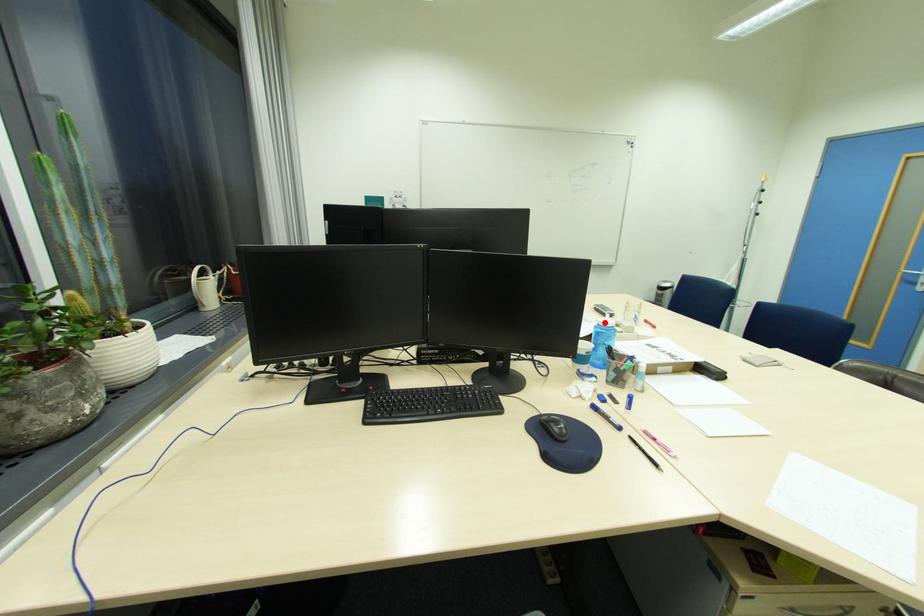
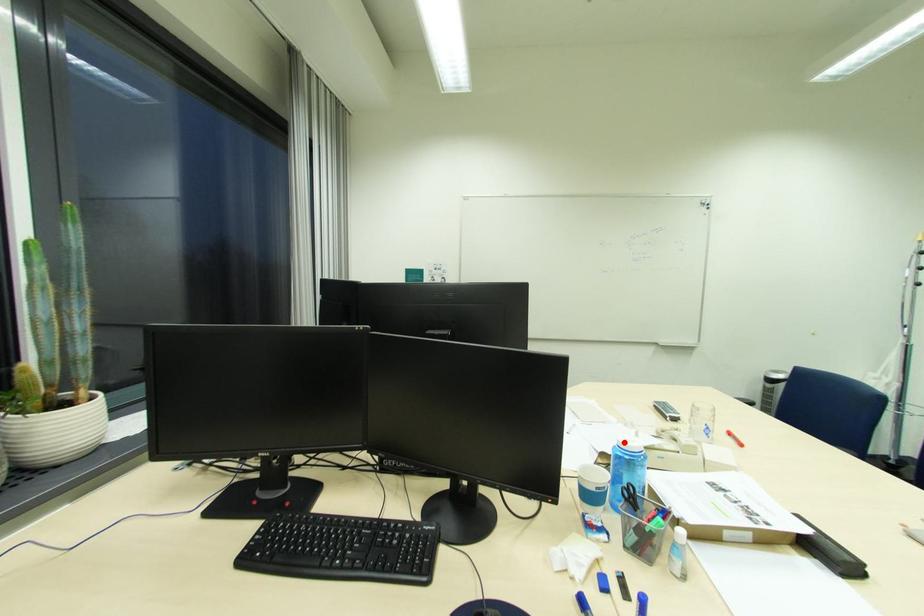
I am providing you with two images of the same scene from different viewpoints. A red point is marked on the first image and another point is marked on the second image. Are the points marked in image1 and image2 representing the same 3D position?

Yes